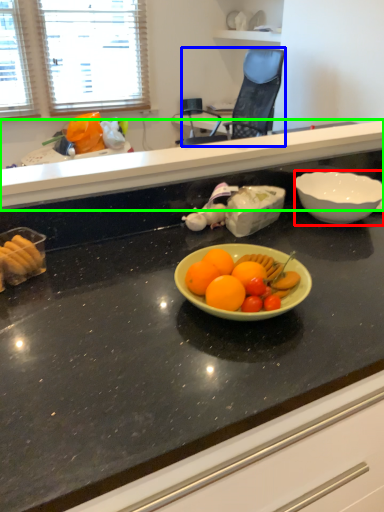
Question: Which object is positioned farthest from bowl (highlighted by a red box)? Select from chair (highlighted by a blue box) and countertop (highlighted by a green box).

Choices:
 (A) chair
 (B) countertop

Answer: (A)